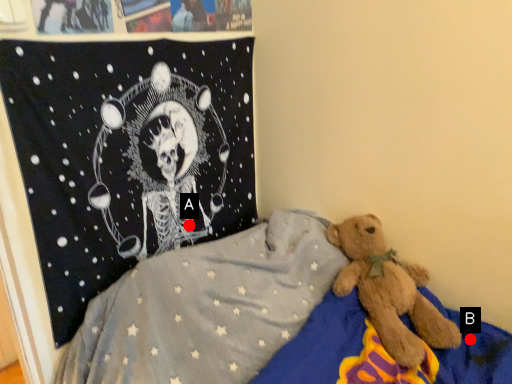
Question: Two points are circled on the image, labeled by A and B beside each circle. Which of the following is the farthest from the observer?

Choices:
 (A) A is further
 (B) B is further

Answer: (A)